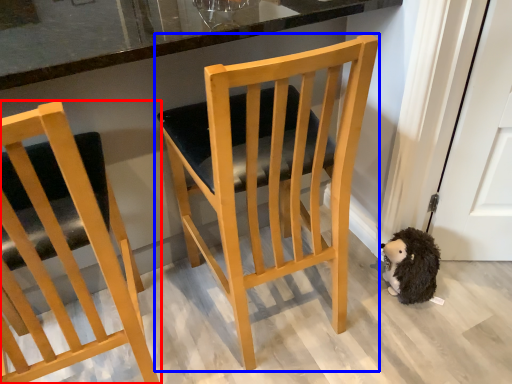
Question: Which object appears farthest to the camera in this image, chair (highlighted by a red box) or chair (highlighted by a blue box)?

Choices:
 (A) chair
 (B) chair

Answer: (B)